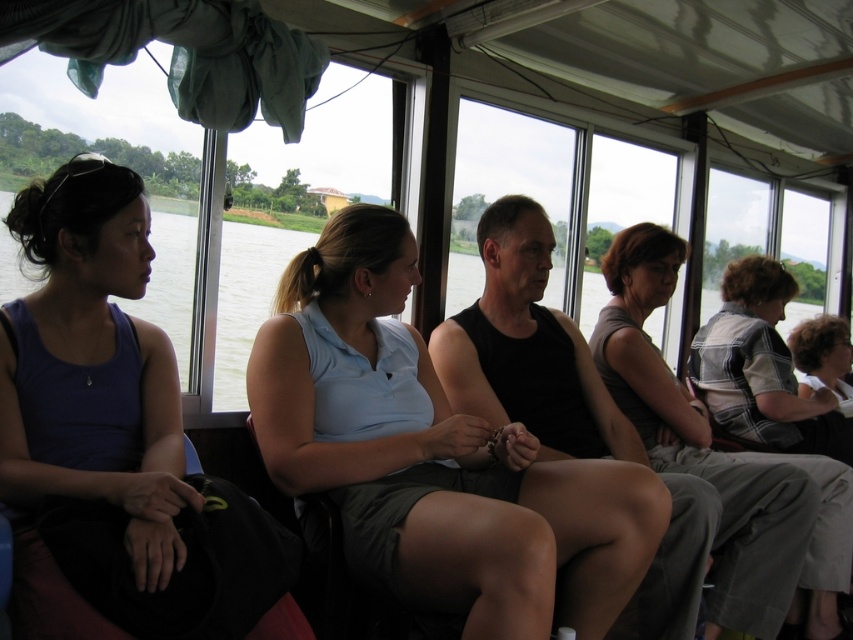
What do you see at coordinates (701, 442) in the screenshot? The width and height of the screenshot is (853, 640). I see `gray fabric skirt at center` at bounding box center [701, 442].

This screenshot has height=640, width=853. In order to click on gray fabric skirt at center in this screenshot , I will do `click(701, 442)`.

Is point (341, 442) closer to camera compared to point (657, 237)?

Yes.

You are a GUI agent. You are given a task and a screenshot of the screen. Output one action in this format:
    pyautogui.click(x=<x>, y=<y>)
    Task: Click on the light blue fabric shirt at center
    This screenshot has height=640, width=853.
    Given the screenshot: What is the action you would take?
    pyautogui.click(x=434, y=456)

Can you confirm if matte purple tank top at left is positioned above gray fabric skirt at center?

Yes.

Between matte purple tank top at left and gray fabric skirt at center, which one has more height?

With more height is gray fabric skirt at center.

The height and width of the screenshot is (640, 853). Describe the element at coordinates (119, 428) in the screenshot. I see `matte purple tank top at left` at that location.

The image size is (853, 640). I want to click on matte purple tank top at left, so click(119, 428).